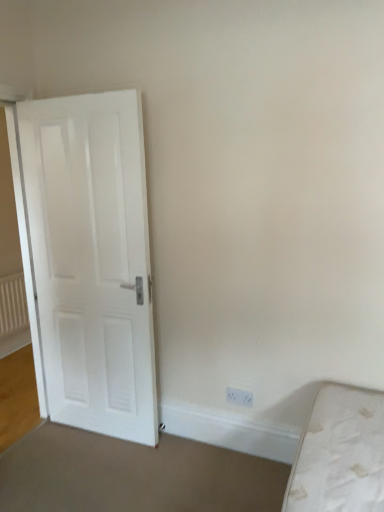
Question: From a real-world perspective, does white plastic electric outlet at lower right stand above white textured radiator at left?

Choices:
 (A) yes
 (B) no

Answer: (B)

Question: From the image's perspective, is white plastic electric outlet at lower right on top of white textured radiator at left?

Choices:
 (A) yes
 (B) no

Answer: (B)

Question: Would you say white plastic electric outlet at lower right is outside white textured radiator at left?

Choices:
 (A) no
 (B) yes

Answer: (B)

Question: Can you confirm if white plastic electric outlet at lower right is positioned to the left of white textured radiator at left?

Choices:
 (A) yes
 (B) no

Answer: (B)

Question: Is white plastic electric outlet at lower right to the right of white textured radiator at left from the viewer's perspective?

Choices:
 (A) no
 (B) yes

Answer: (B)

Question: Visually, is white matte door at left positioned to the left or to the right of white textured radiator at left?

Choices:
 (A) right
 (B) left

Answer: (A)

Question: Based on their sizes in the image, would you say white matte door at left is bigger or smaller than white textured radiator at left?

Choices:
 (A) small
 (B) big

Answer: (B)

Question: In terms of width, does white matte door at left look wider or thinner when compared to white textured radiator at left?

Choices:
 (A) wide
 (B) thin

Answer: (A)

Question: Relative to white textured radiator at left, is white matte door at left in front or behind?

Choices:
 (A) front
 (B) behind

Answer: (A)

Question: Is white textured radiator at left taller or shorter than white plastic electric outlet at lower right?

Choices:
 (A) short
 (B) tall

Answer: (B)

Question: From a real-world perspective, is white textured radiator at left physically located above or below white plastic electric outlet at lower right?

Choices:
 (A) above
 (B) below

Answer: (A)

Question: Looking at their shapes, would you say white textured radiator at left is wider or thinner than white plastic electric outlet at lower right?

Choices:
 (A) wide
 (B) thin

Answer: (A)

Question: Which is correct: white textured radiator at left is inside white plastic electric outlet at lower right, or outside of it?

Choices:
 (A) inside
 (B) outside

Answer: (B)

Question: From a real-world perspective, relative to white matte door at left, is white plastic electric outlet at lower right vertically above or below?

Choices:
 (A) below
 (B) above

Answer: (A)

Question: From their relative heights in the image, would you say white plastic electric outlet at lower right is taller or shorter than white matte door at left?

Choices:
 (A) short
 (B) tall

Answer: (A)